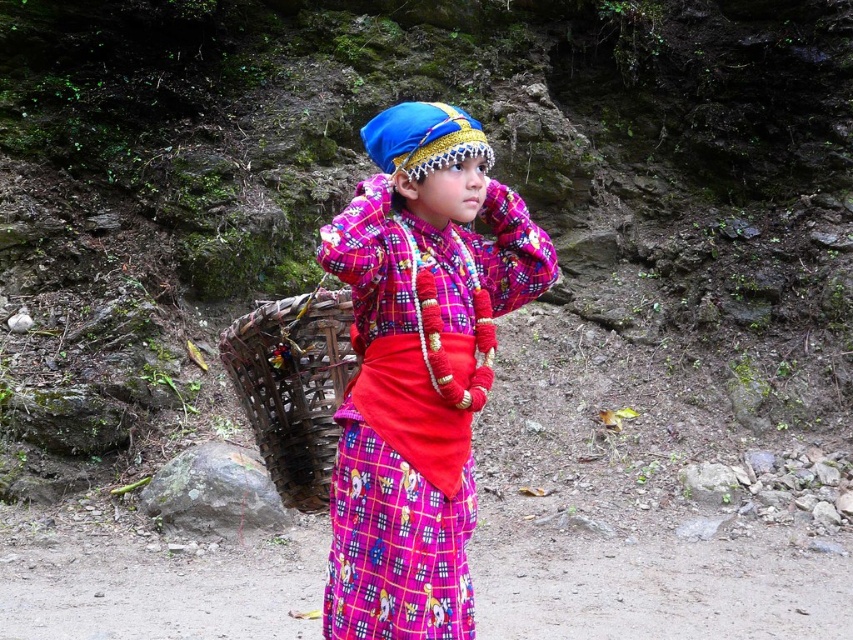
Between plaid fabric shirt at center and natural wood basket at center, which one appears on the right side from the viewer's perspective?

plaid fabric shirt at center

Does plaid fabric shirt at center have a greater height compared to natural wood basket at center?

Indeed, plaid fabric shirt at center has a greater height compared to natural wood basket at center.

Who is more forward, (466,218) or (270,374)?

Positioned in front is point (466,218).

This screenshot has height=640, width=853. In order to click on plaid fabric shirt at center in this screenshot , I will do `click(418, 369)`.